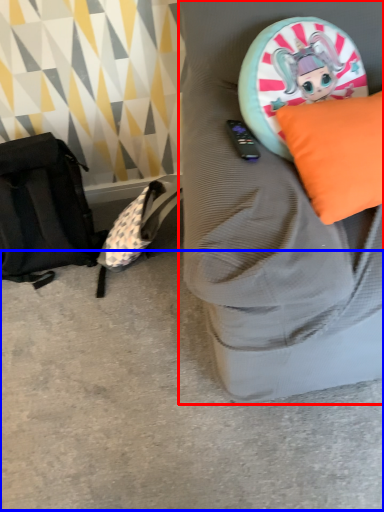
Question: Which object is further to the camera taking this photo, furniture (highlighted by a red box) or concrete (highlighted by a blue box)?

Choices:
 (A) furniture
 (B) concrete

Answer: (B)